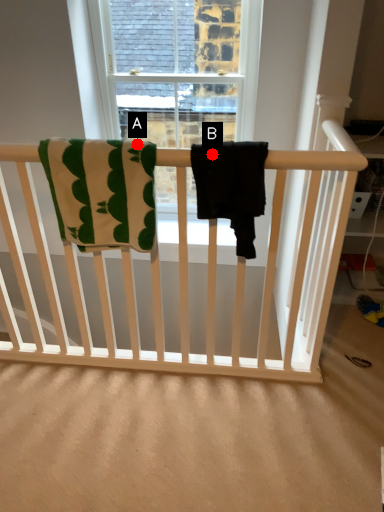
Question: Two points are circled on the image, labeled by A and B beside each circle. Which point appears closest to the camera in this image?

Choices:
 (A) A is closer
 (B) B is closer

Answer: (B)